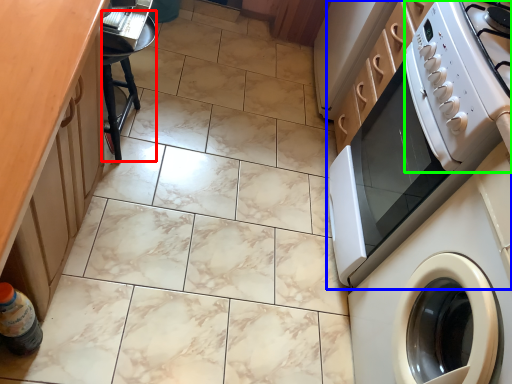
Question: Based on their relative distances, which object is nearer to bar stool (highlighted by a red box)? Choose from home appliance (highlighted by a blue box) and appliance (highlighted by a green box).

Choices:
 (A) home appliance
 (B) appliance

Answer: (A)